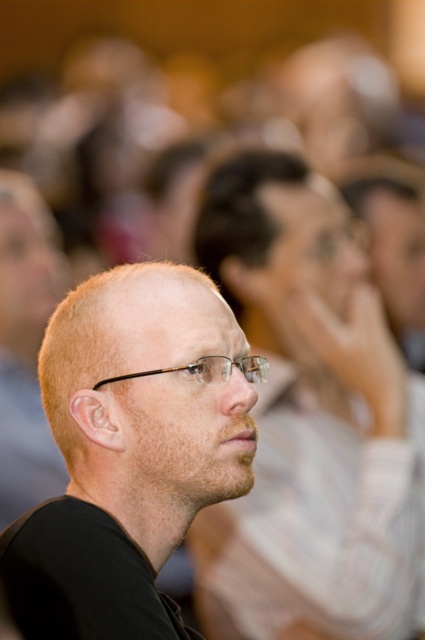
Question: In this image, where is matte black glasses at center located relative to clear plastic glasses at center?

Choices:
 (A) right
 (B) left

Answer: (A)

Question: Considering the real-world distances, which object is closest to the matte black shirt at center?

Choices:
 (A) matte black glasses at center
 (B) clear plastic glasses at center

Answer: (B)

Question: Which point is farther to the camera?

Choices:
 (A) (223, 451)
 (B) (333, 572)
 (C) (215, 381)

Answer: (B)

Question: Does matte black glasses at center have a lesser width compared to matte black shirt at center?

Choices:
 (A) yes
 (B) no

Answer: (B)

Question: Can you confirm if matte black shirt at center is positioned above clear plastic glasses at center?

Choices:
 (A) no
 (B) yes

Answer: (A)

Question: Which of these objects is positioned farthest from the matte black glasses at center?

Choices:
 (A) matte black shirt at center
 (B) clear plastic glasses at center

Answer: (B)